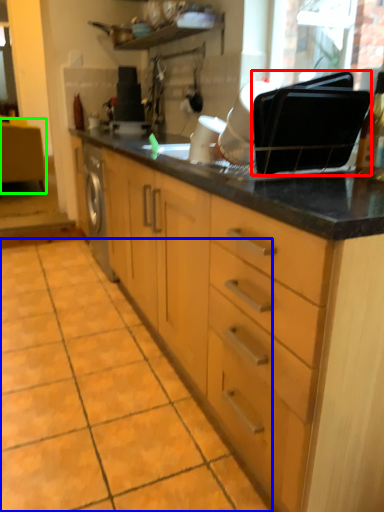
Question: Which object is the farthest from appliance (highlighted by a red box)? Choose among these: ceramic tile (highlighted by a blue box) or vanity (highlighted by a green box).

Choices:
 (A) ceramic tile
 (B) vanity

Answer: (B)